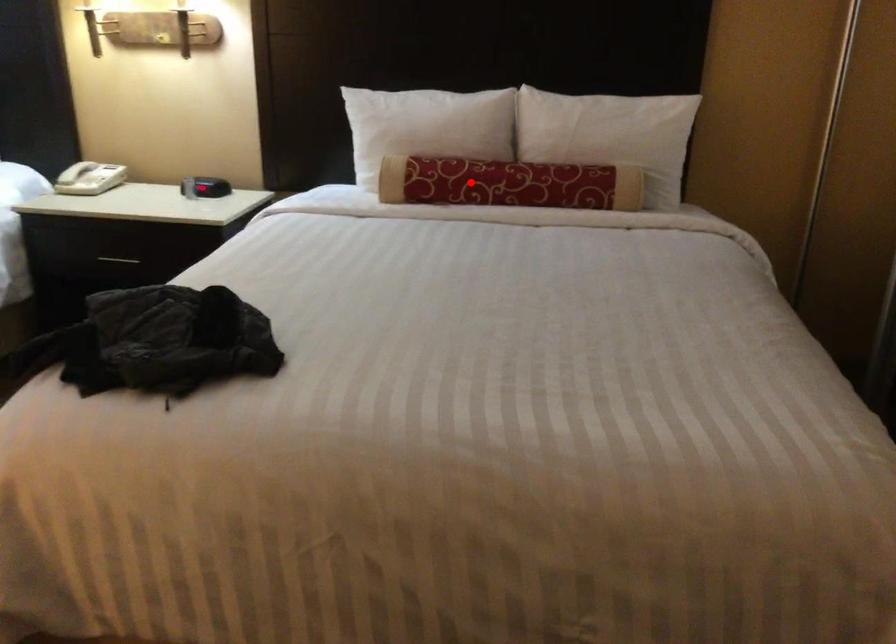
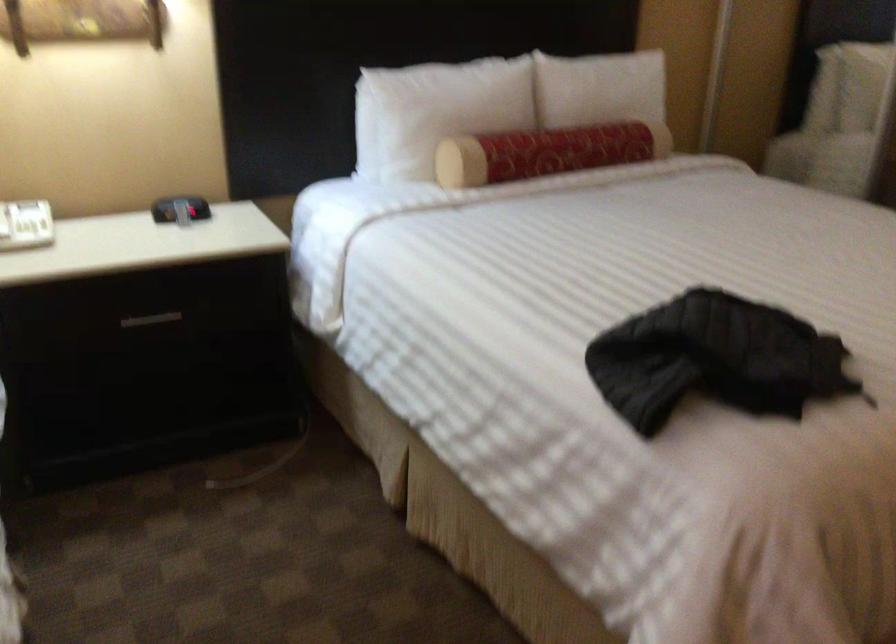
The point at the highlighted location is marked in the first image. Where is the corresponding point in the second image?

(546, 152)